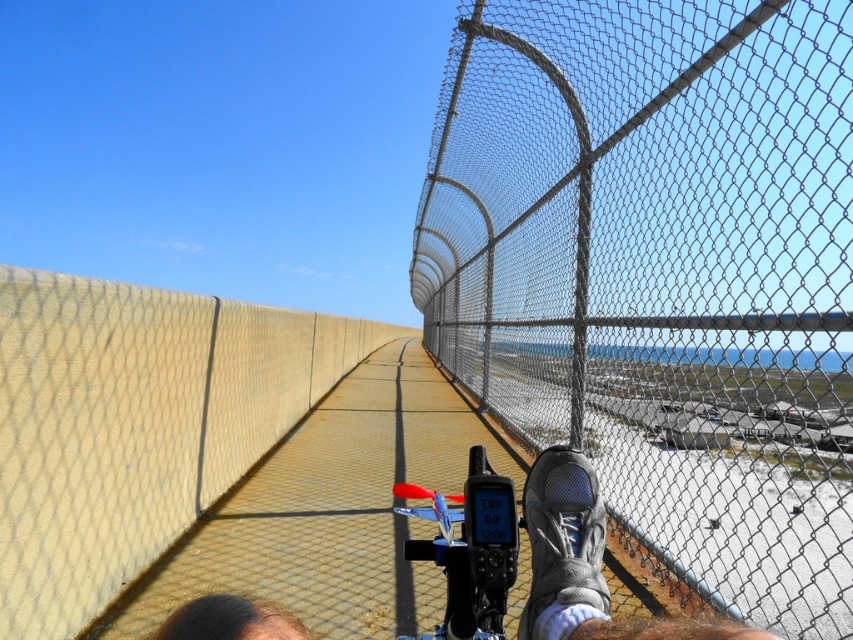
You are navigating a narrow path with a metal mesh fence at right and a gray fabric shoe at lower center. Which object is closer to your current position?

The gray fabric shoe at lower center is closer to your current position because it is behind the metal mesh fence at right, meaning the shoe is nearer to you.

Looking at this image, you are navigating a narrow path with a metal mesh fence at right and a gray mesh shoe at center. Your backpack is 1.2 meters wide. Can you safely carry your backpack through the path without it hitting the fence?

The metal mesh fence at right is wider than the gray mesh shoe at center, but the exact width of the path isn

You are navigating a narrow path between a yellow concrete wall at center and a chainlink fence. Your gray mesh shoe at center is visible. Which object is wider from your perspective?

The yellow concrete wall at center is wider than the gray mesh shoe at center.